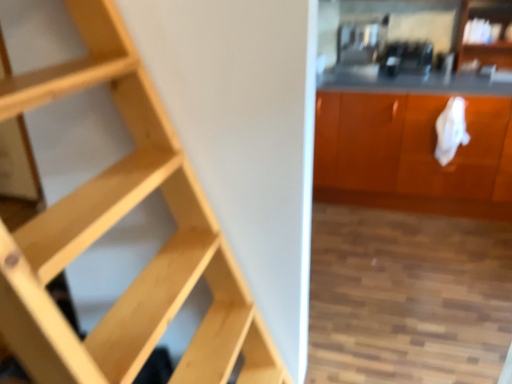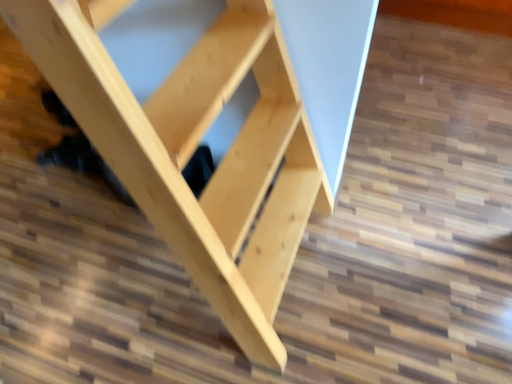
Question: Which way did the camera rotate in the video?

Choices:
 (A) rotated upward
 (B) rotated downward

Answer: (B)